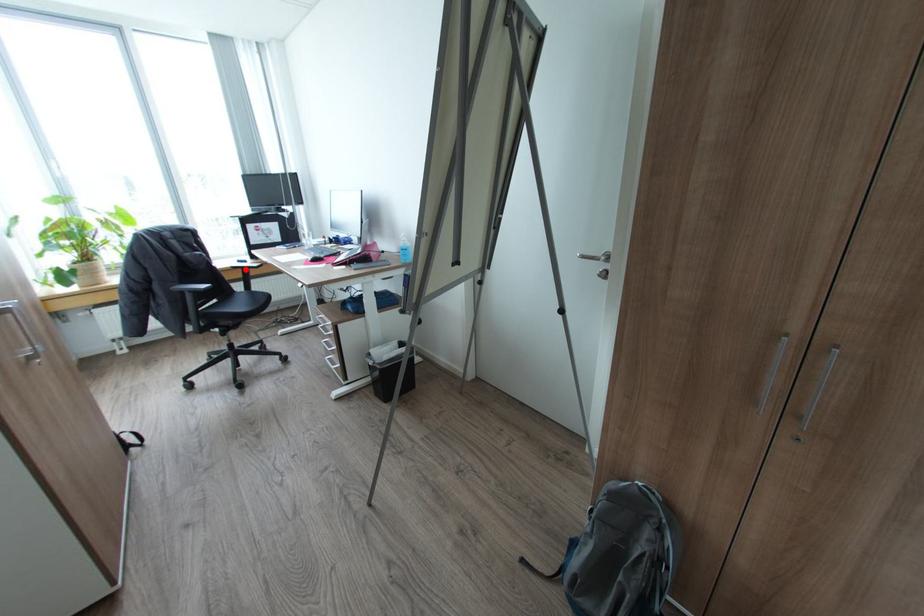
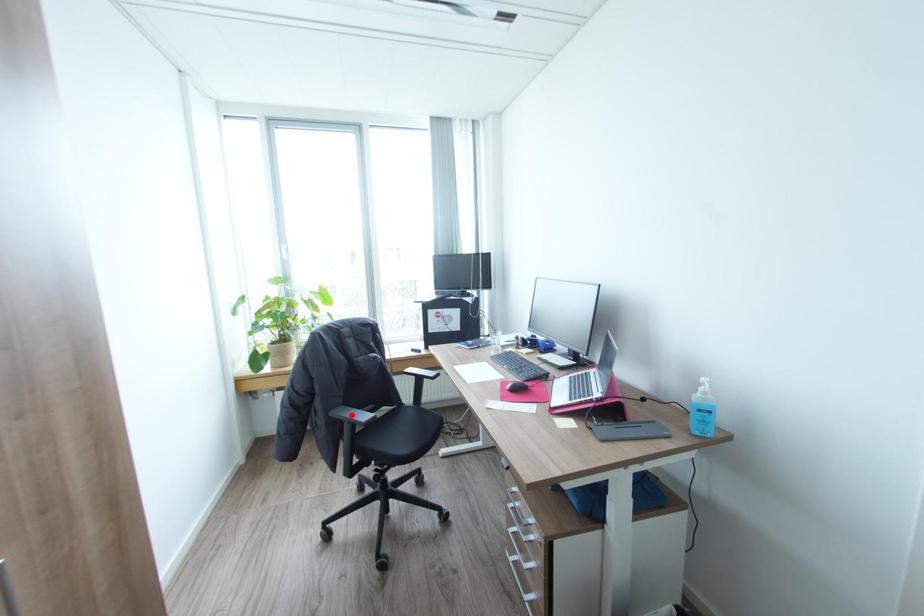
I am providing you with two images of the same scene from different viewpoints. A red point is marked on the first image and another point is marked on the second image. Is the marked point in image1 the same physical position as the marked point in image2?

No